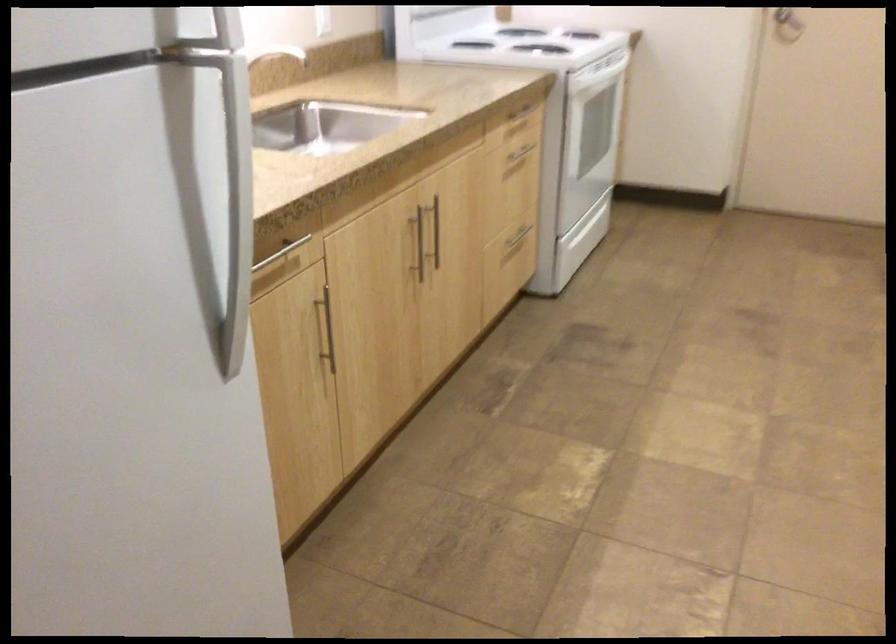
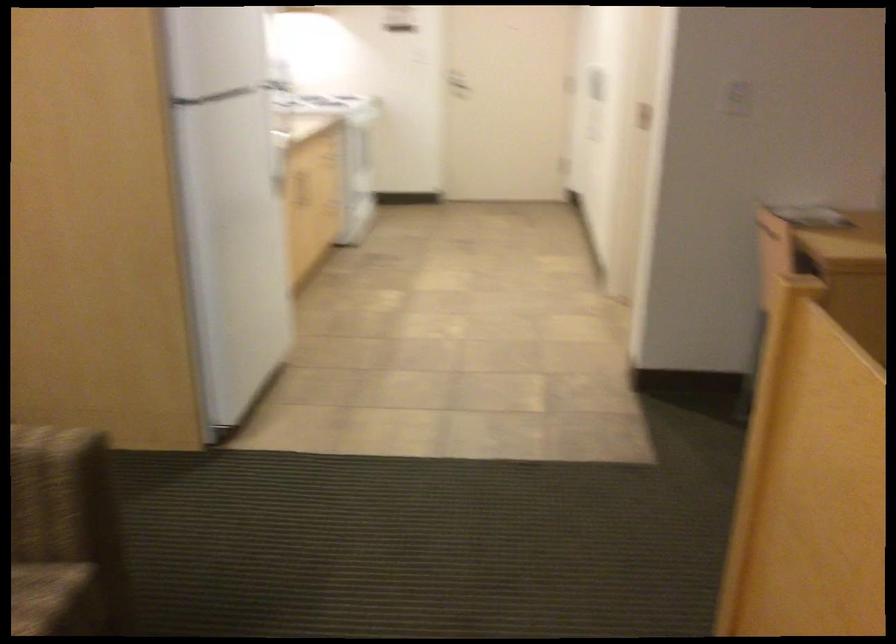
Locate, in the second image, the point that corresponds to the point at 366,266 in the first image.

(297, 187)